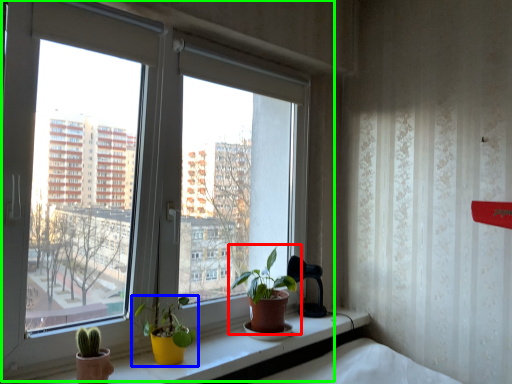
Question: Considering the real-world distances, which object is farthest from houseplant (highlighted by a red box)? houseplant (highlighted by a blue box) or window (highlighted by a green box)?

Choices:
 (A) houseplant
 (B) window

Answer: (B)